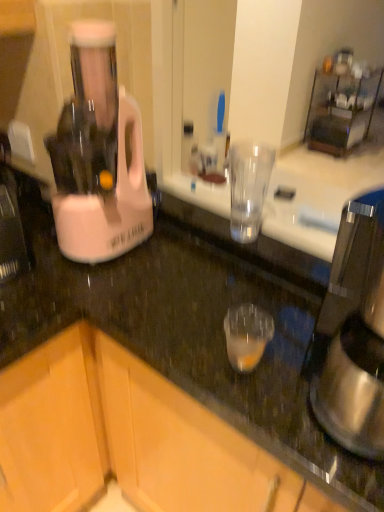
Question: Do you think satin silver coffee maker at right is within pink plastic blender at left, or outside of it?

Choices:
 (A) inside
 (B) outside

Answer: (B)

Question: Is satin silver coffee maker at right in front of or behind pink plastic blender at left in the image?

Choices:
 (A) front
 (B) behind

Answer: (A)

Question: Which object is positioned farthest from the satin silver coffee maker at right?

Choices:
 (A) wooden cabinet at lower left, which ranks as the 2th cabinetry in right-to-left order
 (B) pink plastic blender at left
 (C) wooden cabinet at lower left, which is counted as the 1th cabinetry, starting from the right

Answer: (A)

Question: Which object is positioned farthest from the wooden cabinet at lower left, which is counted as the 1th cabinetry, starting from the right?

Choices:
 (A) satin silver coffee maker at right
 (B) wooden cabinet at lower left, which ranks as the first cabinetry in left-to-right order
 (C) pink plastic blender at left

Answer: (A)